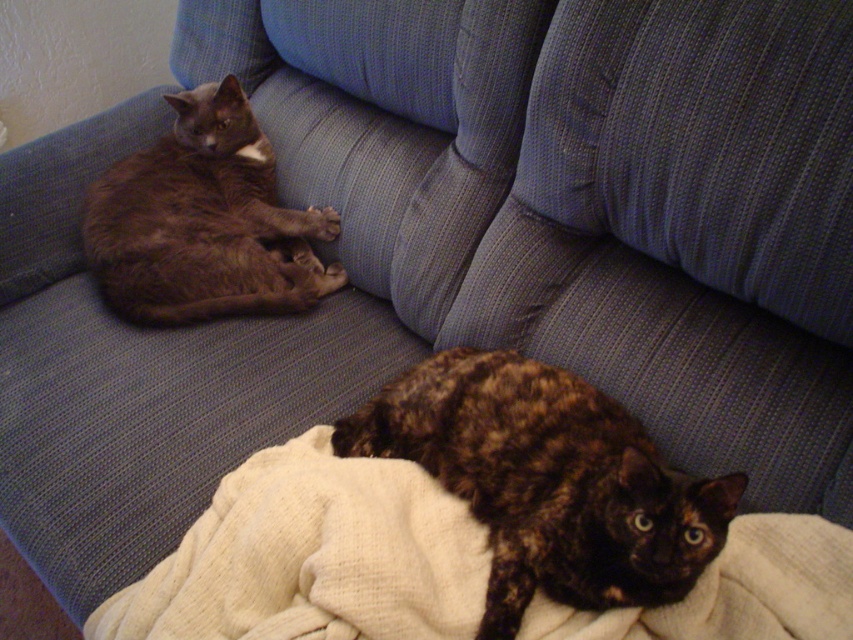
Does creamy woolen blanket at lower center appear under tortoiseshell fur cat at lower center?

Yes.

Is creamy woolen blanket at lower center above tortoiseshell fur cat at lower center?

No, creamy woolen blanket at lower center is not above tortoiseshell fur cat at lower center.

Which is behind, point (466, 636) or point (531, 525)?

Positioned behind is point (531, 525).

The width and height of the screenshot is (853, 640). Identify the location of creamy woolen blanket at lower center. (312, 556).

How distant is tortoiseshell fur cat at lower center from shiny brown cat at left?

The distance of tortoiseshell fur cat at lower center from shiny brown cat at left is 54.57 centimeters.

Can you confirm if tortoiseshell fur cat at lower center is smaller than shiny brown cat at left?

Incorrect, tortoiseshell fur cat at lower center is not smaller in size than shiny brown cat at left.

Who is more forward, (486, 356) or (129, 186)?

Point (486, 356) is in front.

This screenshot has height=640, width=853. In order to click on tortoiseshell fur cat at lower center in this screenshot , I will do 548,481.

Is blue textured cushion at upper right smaller than tortoiseshell fur cat at lower center?

Correct, blue textured cushion at upper right occupies less space than tortoiseshell fur cat at lower center.

Locate an element on the screen. The height and width of the screenshot is (640, 853). blue textured cushion at upper right is located at coordinates (705, 141).